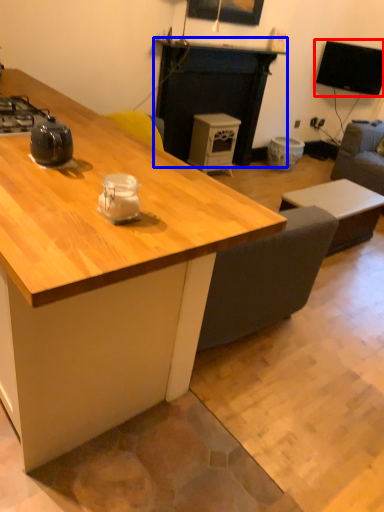
Question: Which object appears closest to the camera in this image, television (highlighted by a red box) or fireplace (highlighted by a blue box)?

Choices:
 (A) television
 (B) fireplace

Answer: (B)